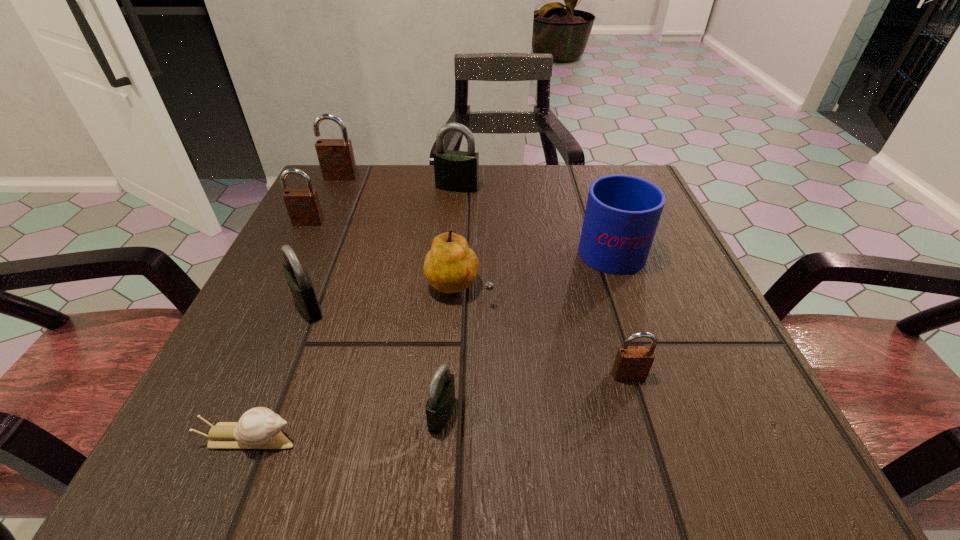
Point out which padlock is positioned as the nearest to the rightmost brown padlock. Please provide its 2D coordinates. Your answer should be formatted as a tuple, i.e. [(x, y)], where the tuple contains the x and y coordinates of a point satisfying the conditions above.

[(441, 396)]

Where is `padlock that is the fifth closest to the leftmost black padlock`? This screenshot has width=960, height=540. padlock that is the fifth closest to the leftmost black padlock is located at coordinates (632, 363).

Identify which black padlock is the second nearest to the second biggest brown padlock. Please provide its 2D coordinates. Your answer should be formatted as a tuple, i.e. [(x, y)], where the tuple contains the x and y coordinates of a point satisfying the conditions above.

[(457, 171)]

You are a GUI agent. You are given a task and a screenshot of the screen. Output one action in this format:
    pyautogui.click(x=<x>, y=<y>)
    Task: Click on the black padlock identified as the closest to the nearest padlock
    The height and width of the screenshot is (540, 960).
    Given the screenshot: What is the action you would take?
    pyautogui.click(x=300, y=284)

Choose which brown padlock is the second nearest neighbor to the blue mug. Please provide its 2D coordinates. Your answer should be formatted as a tuple, i.e. [(x, y)], where the tuple contains the x and y coordinates of a point satisfying the conditions above.

[(336, 157)]

Point out which brown padlock is positioned as the second nearest to the pear. Please provide its 2D coordinates. Your answer should be formatted as a tuple, i.e. [(x, y)], where the tuple contains the x and y coordinates of a point satisfying the conditions above.

[(303, 205)]

This screenshot has height=540, width=960. What are the coordinates of `vacant space that satisfies the following two spatial constraints: 1. on the front-facing side of the seventh farthest object; 2. on the shell of the escargot` in the screenshot? It's located at (647, 438).

I want to click on blank area in the image that satisfies the following two spatial constraints: 1. on the front-facing side of the smallest black padlock; 2. on the right side of the second biggest brown padlock, so click(x=212, y=414).

Where is `free location that satisfies the following two spatial constraints: 1. on the front-facing side of the fifth farthest padlock; 2. on the shell of the escargot`? This screenshot has height=540, width=960. free location that satisfies the following two spatial constraints: 1. on the front-facing side of the fifth farthest padlock; 2. on the shell of the escargot is located at coordinates (647, 438).